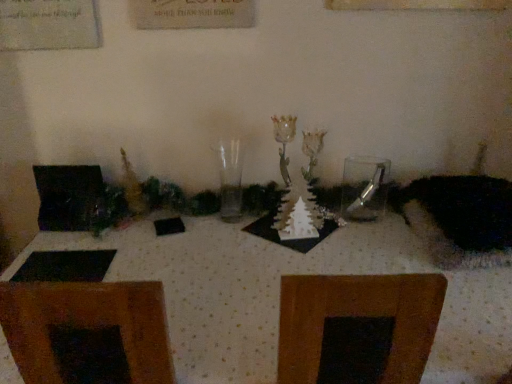
Where is `vacant area that lies between fuzzy black cat at right and clear glass spoon at center`? The height and width of the screenshot is (384, 512). vacant area that lies between fuzzy black cat at right and clear glass spoon at center is located at coordinates (388, 240).